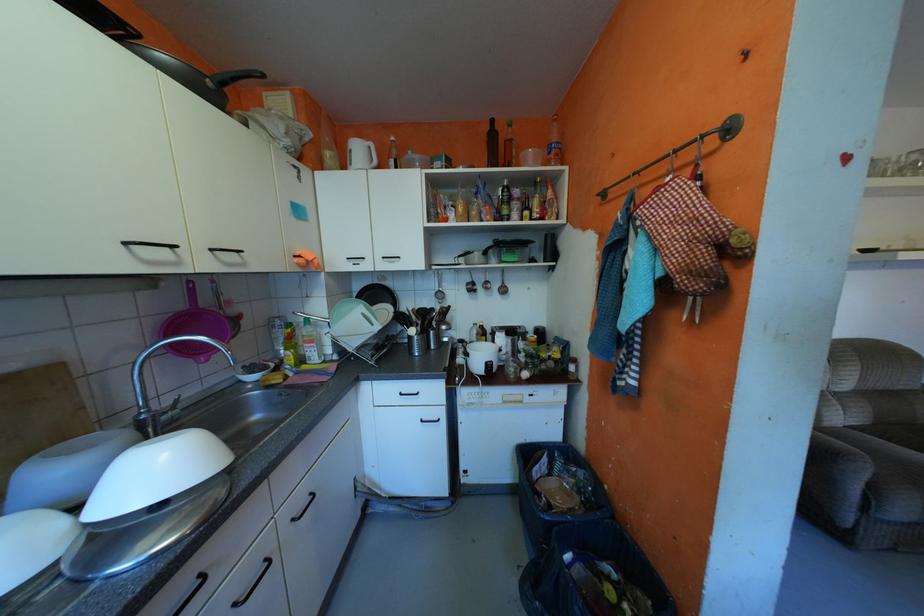
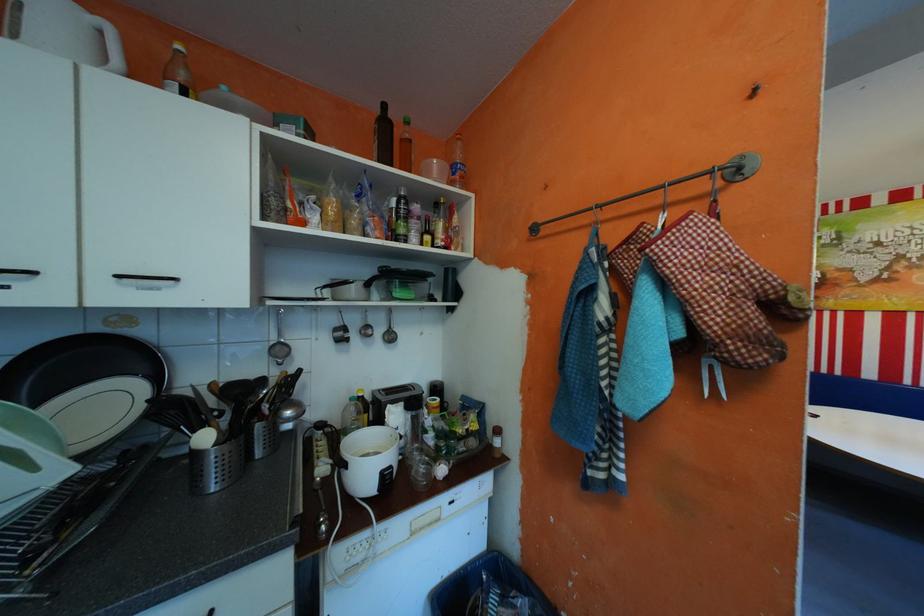
Locate, in the second image, the point that corresponds to (677,254) in the first image.

(715, 310)